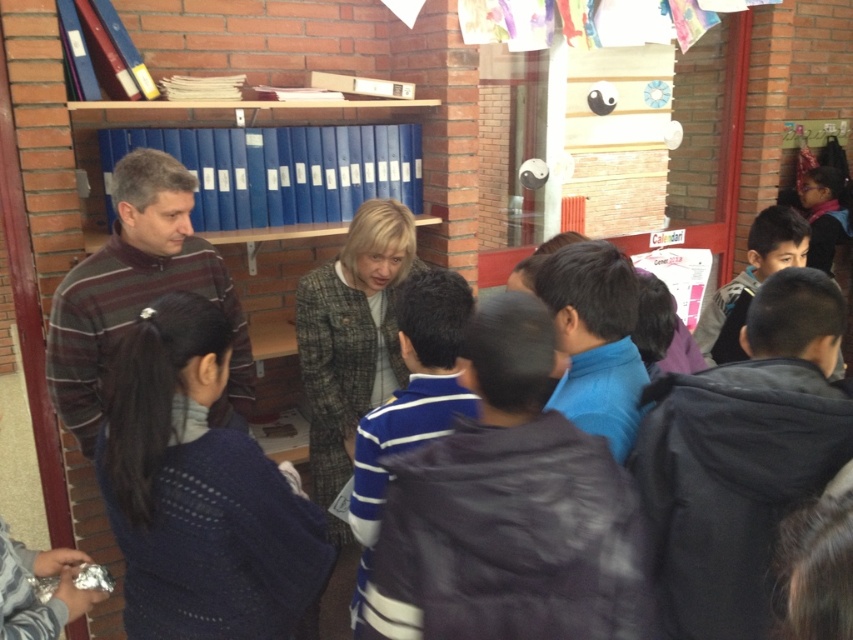
You are a tailor measuring clothing for alterations. You have a tailor mannequin in front of you with the gray tweed jacket at center and the blue striped sweater at center. Which garment has a larger width measurement?

The gray tweed jacket at center has a larger width measurement than the blue striped sweater at center, as its width surpasses the sweater.

You are a tailor who needs to adjust the sleeves of the gray tweed jacket at center and the blue striped sweater at center. Which garment should you work on first if you want to start with the one that is currently covering the other?

The gray tweed jacket at center is positioned over the blue striped sweater at center, so you should adjust the sleeves of the gray tweed jacket at center first since it is covering the sweater.